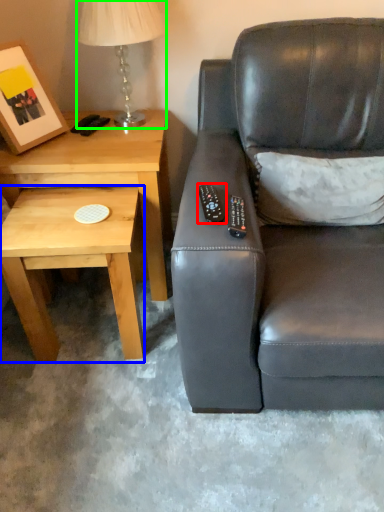
Question: Considering the real-world distances, which object is farthest from remote (highlighted by a red box)? coffee table (highlighted by a blue box) or table lamp (highlighted by a green box)?

Choices:
 (A) coffee table
 (B) table lamp

Answer: (B)